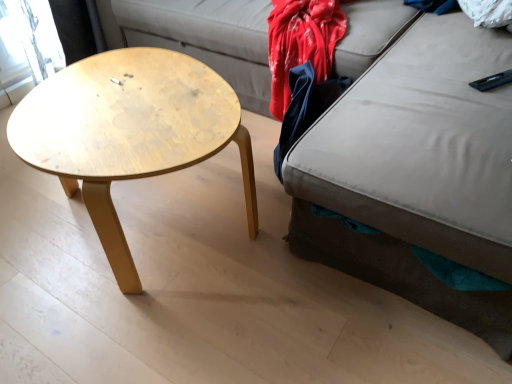
Where is `free space on the front side of natural wood coffee table at left`? The height and width of the screenshot is (384, 512). free space on the front side of natural wood coffee table at left is located at coordinates (154, 331).